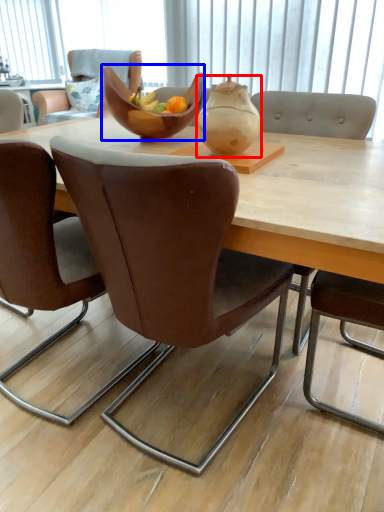
Question: Among these objects, which one is farthest to the camera, tea pot (highlighted by a red box) or bowl (highlighted by a blue box)?

Choices:
 (A) tea pot
 (B) bowl

Answer: (B)